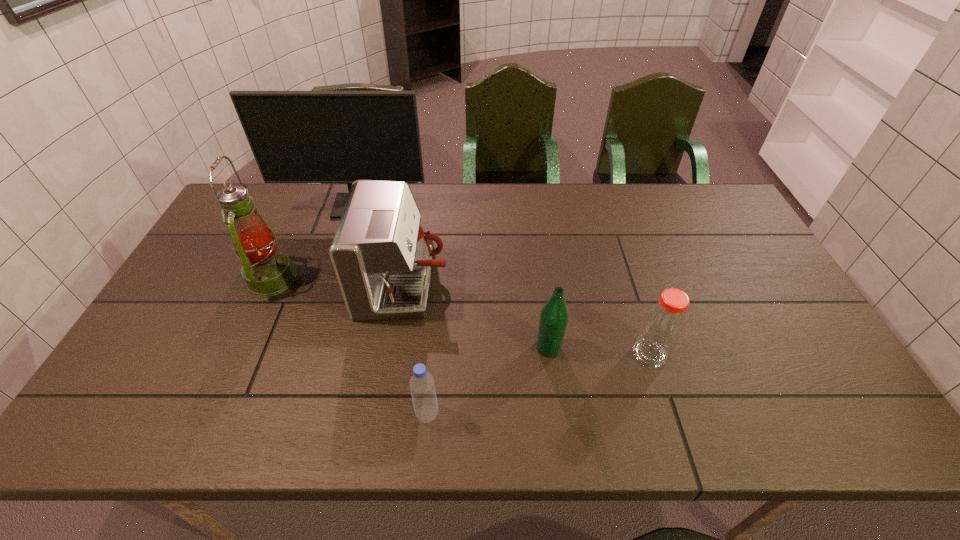
The width and height of the screenshot is (960, 540). I want to click on free space located on the right of the second bottle from left to right, so click(700, 348).

You are a GUI agent. You are given a task and a screenshot of the screen. Output one action in this format:
    pyautogui.click(x=<x>, y=<y>)
    Task: Click on the vacant area situated on the left of the rightmost bottle
    This screenshot has height=540, width=960.
    Given the screenshot: What is the action you would take?
    pyautogui.click(x=543, y=354)

At what (x,y) coordinates should I click in order to perform the action: click on vacant space located 0.050m on the back of the shortest object. Please return your answer as a coordinate pair (x, y). Looking at the image, I should click on (430, 383).

Identify the location of object located in the far edge section of the desktop. (296, 136).

The height and width of the screenshot is (540, 960). I want to click on object positioned at the near edge, so click(x=422, y=386).

Where is `free space at the far edge of the desktop`? The width and height of the screenshot is (960, 540). free space at the far edge of the desktop is located at coordinates point(559,224).

I want to click on vacant space at the near edge, so click(x=774, y=408).

This screenshot has width=960, height=540. In order to click on blank space at the right edge of the desktop in this screenshot , I will do `click(741, 244)`.

Where is `blank area at the near right corner`? The width and height of the screenshot is (960, 540). blank area at the near right corner is located at coordinates tap(827, 434).

Find the location of a particular element. Image resolution: width=960 pixels, height=540 pixels. vacant area that lies between the coffee maker and the second object from right to left is located at coordinates (476, 317).